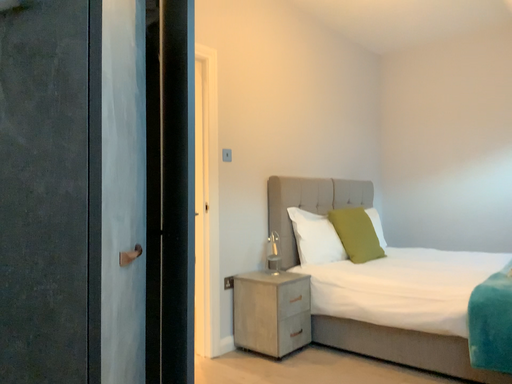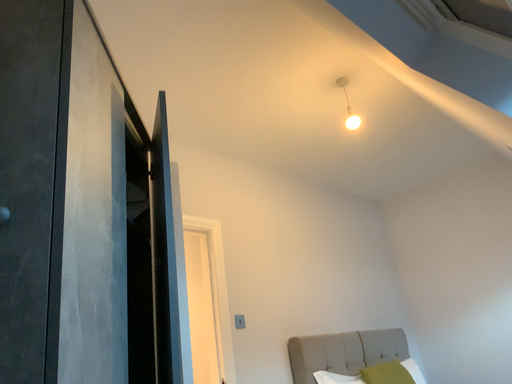
Question: Which way did the camera rotate in the video?

Choices:
 (A) rotated upward
 (B) rotated downward

Answer: (A)